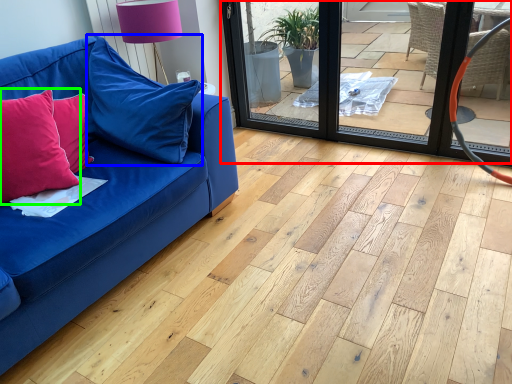
Question: Which is nearer to the screen door (highlighted by a red box)? pillow (highlighted by a blue box) or pillow (highlighted by a green box).

Choices:
 (A) pillow
 (B) pillow

Answer: (A)